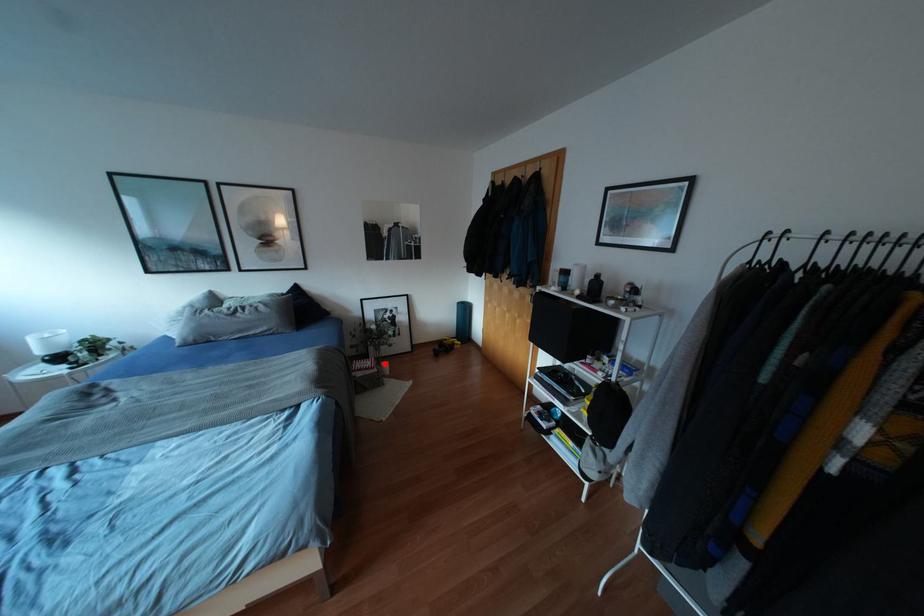
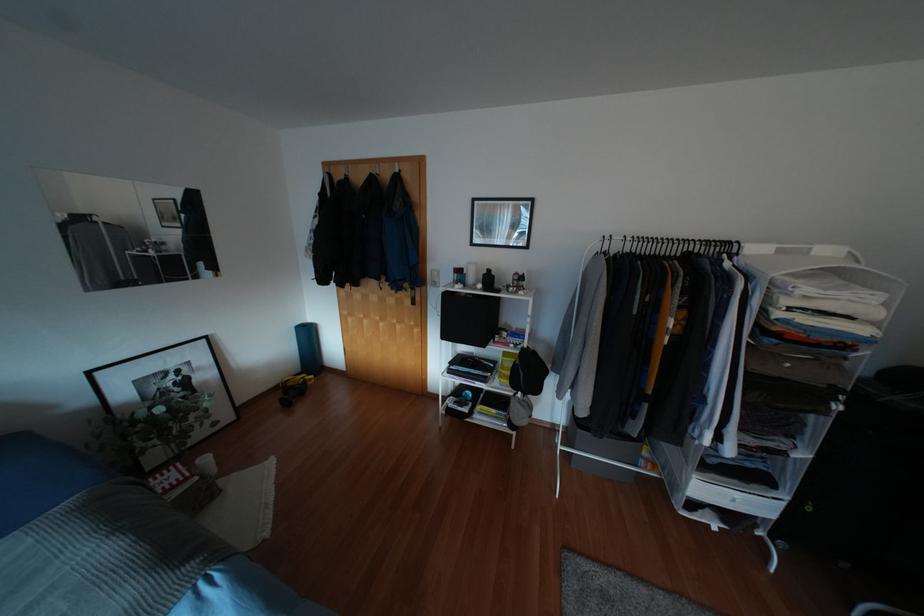
Locate, in the second image, the point that corresponds to the highlighted location in the first image.

(205, 459)